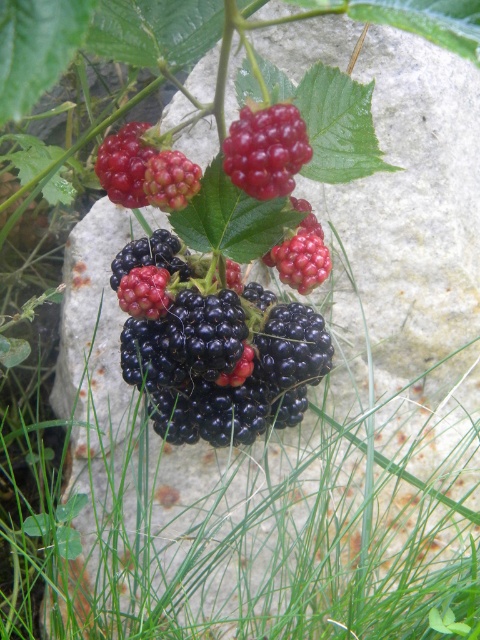
Question: Can you confirm if shiny black berries at center is positioned above shiny red berries at center?

Choices:
 (A) no
 (B) yes

Answer: (A)

Question: Among these objects, which one is farthest from the camera?

Choices:
 (A) shiny red berries at center
 (B) shiny black berries at center

Answer: (B)

Question: Among these objects, which one is farthest from the camera?

Choices:
 (A) shiny red berries at center
 (B) shiny black berries at center

Answer: (B)

Question: Can you confirm if shiny black berries at center is thinner than shiny red berries at center?

Choices:
 (A) no
 (B) yes

Answer: (A)

Question: Does shiny black berries at center have a greater width compared to shiny red berries at center?

Choices:
 (A) no
 (B) yes

Answer: (B)